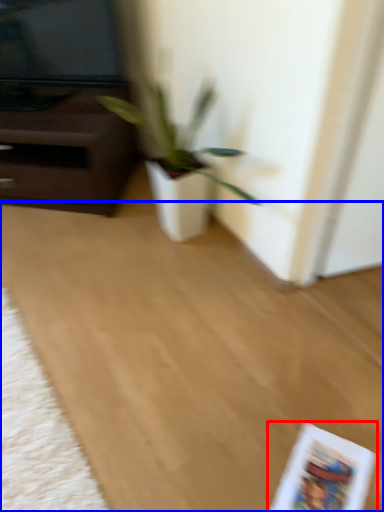
Question: Which of the following is the farthest to the observer, paperback book (highlighted by a red box) or plain (highlighted by a blue box)?

Choices:
 (A) paperback book
 (B) plain

Answer: (A)